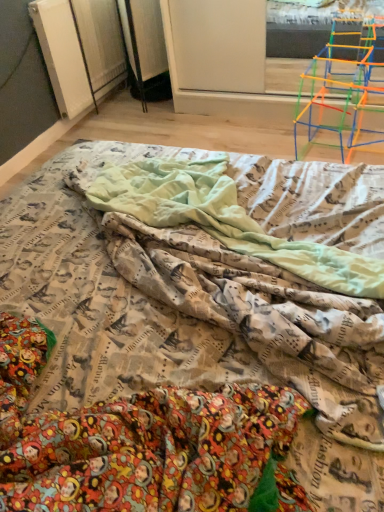
Question: From a real-world perspective, is printed fabric blanket at center physically above translucent plastic toy at upper right?

Choices:
 (A) yes
 (B) no

Answer: (B)

Question: Can you see printed fabric blanket at center touching translucent plastic toy at upper right?

Choices:
 (A) no
 (B) yes

Answer: (A)

Question: Considering the relative sizes of printed fabric blanket at center and translucent plastic toy at upper right in the image provided, is printed fabric blanket at center smaller than translucent plastic toy at upper right?

Choices:
 (A) yes
 (B) no

Answer: (A)

Question: Is printed fabric blanket at center turned away from translucent plastic toy at upper right?

Choices:
 (A) yes
 (B) no

Answer: (B)

Question: Does printed fabric blanket at center have a greater height compared to translucent plastic toy at upper right?

Choices:
 (A) no
 (B) yes

Answer: (A)

Question: Is printed fabric blanket at center shorter than translucent plastic toy at upper right?

Choices:
 (A) yes
 (B) no

Answer: (A)

Question: Can you confirm if translucent plastic toy at upper right is smaller than printed fabric blanket at center?

Choices:
 (A) yes
 (B) no

Answer: (B)

Question: From a real-world perspective, is translucent plastic toy at upper right positioned over printed fabric blanket at center based on gravity?

Choices:
 (A) yes
 (B) no

Answer: (A)

Question: Considering the relative sizes of translucent plastic toy at upper right and printed fabric blanket at center in the image provided, is translucent plastic toy at upper right thinner than printed fabric blanket at center?

Choices:
 (A) yes
 (B) no

Answer: (A)

Question: Is translucent plastic toy at upper right closer to camera compared to printed fabric blanket at center?

Choices:
 (A) no
 (B) yes

Answer: (A)

Question: From a real-world perspective, is translucent plastic toy at upper right physically below printed fabric blanket at center?

Choices:
 (A) no
 (B) yes

Answer: (A)

Question: Is translucent plastic toy at upper right taller than printed fabric blanket at center?

Choices:
 (A) no
 (B) yes

Answer: (B)

Question: Considering the relative positions of printed fabric bed at center and printed fabric blanket at center in the image provided, is printed fabric bed at center to the left of printed fabric blanket at center from the viewer's perspective?

Choices:
 (A) yes
 (B) no

Answer: (A)